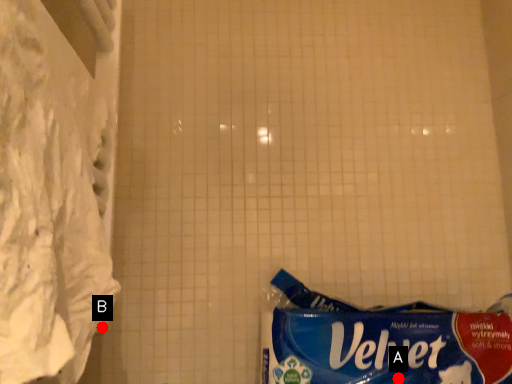
Question: Two points are circled on the image, labeled by A and B beside each circle. Which point appears farthest from the camera in this image?

Choices:
 (A) A is further
 (B) B is further

Answer: (B)